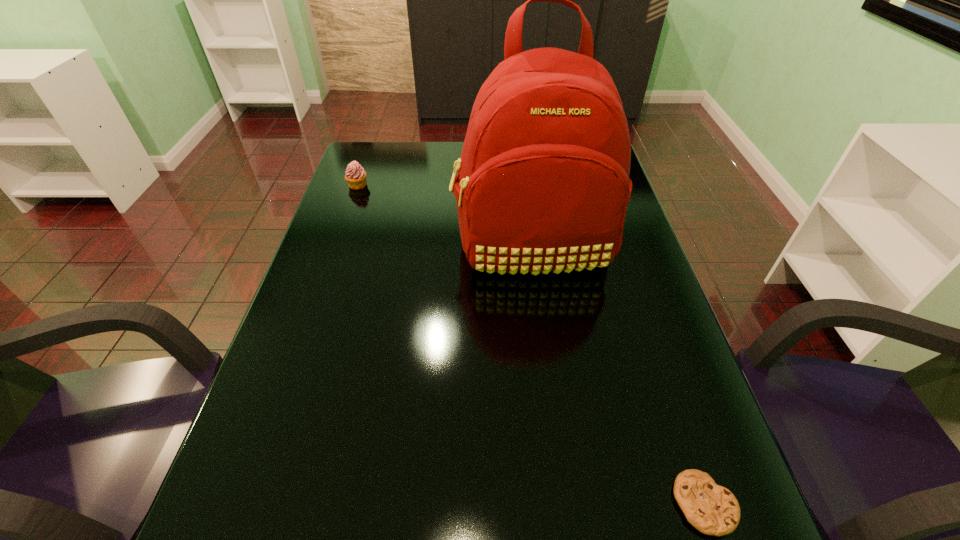
Identify the location of object situated at the left edge. The image size is (960, 540). (355, 175).

You are a GUI agent. You are given a task and a screenshot of the screen. Output one action in this format:
    pyautogui.click(x=<x>, y=<y>)
    Task: Click on the backpack situated at the right edge
    The image size is (960, 540).
    Given the screenshot: What is the action you would take?
    pyautogui.click(x=543, y=185)

Identify the location of cookie at the right edge. The height and width of the screenshot is (540, 960). (712, 509).

Where is `object at the near right corner`? The image size is (960, 540). object at the near right corner is located at coordinates (712, 509).

Where is `vacant space at the left edge of the desktop`? The image size is (960, 540). vacant space at the left edge of the desktop is located at coordinates (382, 221).

The width and height of the screenshot is (960, 540). I want to click on free region at the right edge of the desktop, so click(616, 271).

At what (x,y) coordinates should I click in order to perform the action: click on vacant space that's between the nearest object and the tallest object. Please return your answer as a coordinate pair (x, y). Looking at the image, I should click on (618, 376).

Where is `free space between the tallest object and the leftmost object`? The image size is (960, 540). free space between the tallest object and the leftmost object is located at coordinates (445, 217).

I want to click on blank region between the shortest object and the tallest object, so click(618, 376).

You are a GUI agent. You are given a task and a screenshot of the screen. Output one action in this format:
    pyautogui.click(x=<x>, y=<y>)
    Task: Click on the vacant area between the nearest object and the leftmost object
    The image size is (960, 540).
    Given the screenshot: What is the action you would take?
    pos(531,345)